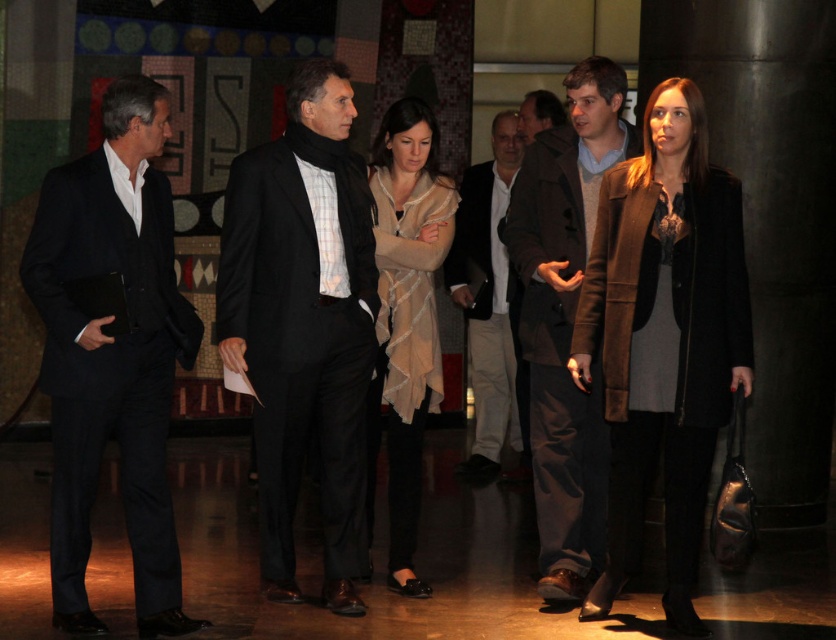
Is brown wool coat at right positioned before beige textured coat at center?

Yes.

Is point (699, 621) in front of point (429, 296)?

Yes, it is.

In order to click on brown wool coat at right in this screenshot , I will do `click(664, 339)`.

Is matte black suit at left to the left of beige textured dress at center from the viewer's perspective?

Indeed, matte black suit at left is positioned on the left side of beige textured dress at center.

Does matte black suit at left appear on the right side of beige textured dress at center?

No, matte black suit at left is not to the right of beige textured dress at center.

Which is in front, point (135, 250) or point (395, 253)?

Point (135, 250) is more forward.

This screenshot has height=640, width=836. Find the location of `matte black suit at left`. matte black suit at left is located at coordinates (111, 353).

Is matte black suit at center positioned at the back of brown leather jacket at center?

No, matte black suit at center is in front of brown leather jacket at center.

Which is in front, point (350, 422) or point (533, 124)?

Point (350, 422) is more forward.

The height and width of the screenshot is (640, 836). I want to click on matte black suit at center, so click(303, 323).